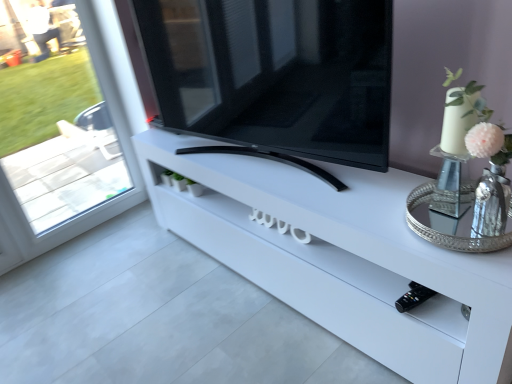
Where is `black glossy tv at center`? This screenshot has width=512, height=384. black glossy tv at center is located at coordinates (275, 76).

The image size is (512, 384). What are the coordinates of `transparent glass window at left` in the screenshot? It's located at tap(65, 139).

This screenshot has width=512, height=384. In order to click on silver metallic tray at right in this screenshot , I will do `click(448, 234)`.

What do you see at coordinates (448, 234) in the screenshot?
I see `silver metallic tray at right` at bounding box center [448, 234].

The width and height of the screenshot is (512, 384). In order to click on white glossy tv stand at center in this screenshot , I will do `click(342, 258)`.

You are a GUI agent. You are given a task and a screenshot of the screen. Output one action in this format:
    pyautogui.click(x=<x>, y=<y>)
    Task: Click on the black glossy tv at center
    
    Given the screenshot: What is the action you would take?
    pyautogui.click(x=275, y=76)

Which is more to the left, black glossy tv at center or silver metallic tray at right?

black glossy tv at center is more to the left.

How different are the orientations of black glossy tv at center and silver metallic tray at right in degrees?

The angular difference between black glossy tv at center and silver metallic tray at right is 10.8 degrees.

From the image's perspective, does black glossy tv at center appear lower than silver metallic tray at right?

No, from the image's perspective, black glossy tv at center is not below silver metallic tray at right.

Which of these two, white glossy tv stand at center or black glossy tv at center, is bigger?

With larger size is white glossy tv stand at center.

Which is correct: white glossy tv stand at center is inside black glossy tv at center, or outside of it?

white glossy tv stand at center exists outside the volume of black glossy tv at center.

From the image's perspective, is white glossy tv stand at center located above or below black glossy tv at center?

Based on their image positions, white glossy tv stand at center is located beneath black glossy tv at center.

From a real-world perspective, is white glossy tv stand at center above or below black glossy tv at center?

From a real-world perspective, white glossy tv stand at center is physically below black glossy tv at center.

From a real-world perspective, is black glossy tv at center above or below transparent glass window at left?

From a real-world perspective, black glossy tv at center is physically above transparent glass window at left.

Where is `window located on the left of black glossy tv at center`? This screenshot has width=512, height=384. window located on the left of black glossy tv at center is located at coordinates (65, 139).

Which of these two, black glossy tv at center or transparent glass window at left, stands shorter?

With less height is black glossy tv at center.

How much distance is there between black glossy tv at center and transparent glass window at left?

black glossy tv at center and transparent glass window at left are 1.58 meters apart from each other.

I want to click on glass table behind the white glossy tv stand at center, so click(448, 234).

From a real-world perspective, is silver metallic tray at right located higher than white glossy tv stand at center?

Yes, from a real-world perspective, silver metallic tray at right is above white glossy tv stand at center.

Is point (489, 243) farther from camera compared to point (254, 281)?

No.

Are silver metallic tray at right and white glossy tv stand at center beside each other?

No, silver metallic tray at right is not beside white glossy tv stand at center.

From the image's perspective, between white glossy tv stand at center and silver metallic tray at right, who is located below?

white glossy tv stand at center is shown below in the image.

In terms of width, does white glossy tv stand at center look wider or thinner when compared to silver metallic tray at right?

In the image, white glossy tv stand at center appears to be wider than silver metallic tray at right.

From a real-world perspective, between white glossy tv stand at center and silver metallic tray at right, who is vertically lower?

white glossy tv stand at center, from a real-world perspective.

Considering the sizes of silver metallic tray at right and black glossy tv at center in the image, is silver metallic tray at right taller or shorter than black glossy tv at center?

Considering their sizes, silver metallic tray at right has less height than black glossy tv at center.

Considering the positions of objects silver metallic tray at right and black glossy tv at center in the image provided, who is more to the left, silver metallic tray at right or black glossy tv at center?

black glossy tv at center is more to the left.

How distant is silver metallic tray at right from black glossy tv at center?

22.84 inches.

Is silver metallic tray at right aimed at black glossy tv at center?

No, silver metallic tray at right is not facing towards black glossy tv at center.

Consider the image. Considering their positions, is transparent glass window at left located in front of or behind silver metallic tray at right?

transparent glass window at left is positioned farther from the viewer than silver metallic tray at right.

How different are the orientations of transparent glass window at left and silver metallic tray at right in degrees?

The angular difference between transparent glass window at left and silver metallic tray at right is 88.7 degrees.

Which is closer, (49,213) or (509,238)?

Point (49,213) is farther from the camera than point (509,238).

Measure the distance from transparent glass window at left to silver metallic tray at right.

The distance of transparent glass window at left from silver metallic tray at right is 3.80 meters.

Where is `glass table below the black glossy tv at center (from a real-world perspective)`? glass table below the black glossy tv at center (from a real-world perspective) is located at coordinates (448, 234).

The width and height of the screenshot is (512, 384). I want to click on television above the white glossy tv stand at center (from the image's perspective), so click(x=275, y=76).

Estimate the real-world distances between objects in this image. Which object is further from white glossy tv stand at center, silver metallic tray at right or transparent glass window at left?

transparent glass window at left.

Considering their positions, is white glossy tv stand at center positioned closer to transparent glass window at left than black glossy tv at center?

The object closer to transparent glass window at left is black glossy tv at center.

From the image, which object appears to be farther from black glossy tv at center, transparent glass window at left or white glossy tv stand at center?

transparent glass window at left lies further to black glossy tv at center than the other object.

Based on their spatial positions, is black glossy tv at center or transparent glass window at left further from silver metallic tray at right?

transparent glass window at left is positioned further to the anchor silver metallic tray at right.

From the image, which object appears to be nearer to transparent glass window at left, black glossy tv at center or silver metallic tray at right?

The object closer to transparent glass window at left is black glossy tv at center.

When comparing their distances from transparent glass window at left, does silver metallic tray at right or black glossy tv at center seem closer?

Among the two, black glossy tv at center is located nearer to transparent glass window at left.

Considering their positions, is white glossy tv stand at center positioned closer to transparent glass window at left than silver metallic tray at right?

white glossy tv stand at center is positioned closer to the anchor transparent glass window at left.

Estimate the real-world distances between objects in this image. Which object is closer to silver metallic tray at right, transparent glass window at left or black glossy tv at center?

black glossy tv at center lies closer to silver metallic tray at right than the other object.

Locate an element on the screen. The height and width of the screenshot is (384, 512). furniture between black glossy tv at center and silver metallic tray at right in the horizontal direction is located at coordinates (342, 258).

Find the location of a particular element. furniture situated between transparent glass window at left and silver metallic tray at right from left to right is located at coordinates (342, 258).

Find the location of a particular element. The width and height of the screenshot is (512, 384). television between transparent glass window at left and silver metallic tray at right from left to right is located at coordinates (275, 76).

In order to click on television between transparent glass window at left and white glossy tv stand at center in the horizontal direction in this screenshot , I will do (275, 76).